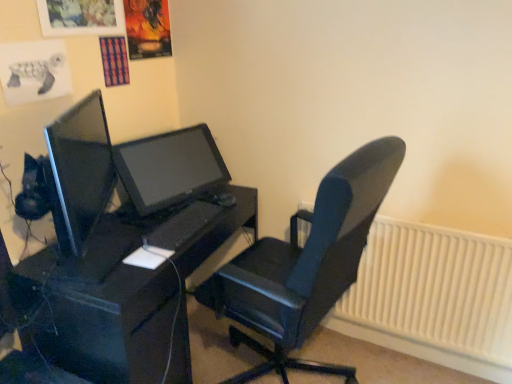
Question: In terms of size, does black leather chair at center appear bigger or smaller than white plastic radiator at lower right?

Choices:
 (A) small
 (B) big

Answer: (B)

Question: Is black leather chair at center situated inside white plastic radiator at lower right or outside?

Choices:
 (A) inside
 (B) outside

Answer: (B)

Question: Based on their relative distances, which object is nearer to the white plastic radiator at lower right?

Choices:
 (A) black matte desk at center
 (B) matte black monitor at center
 (C) black matte keyboard at center
 (D) black leather chair at center

Answer: (D)

Question: Estimate the real-world distances between objects in this image. Which object is farther from the white plastic radiator at lower right?

Choices:
 (A) black matte desk at center
 (B) black matte keyboard at center
 (C) matte black monitor at center
 (D) black leather chair at center

Answer: (C)